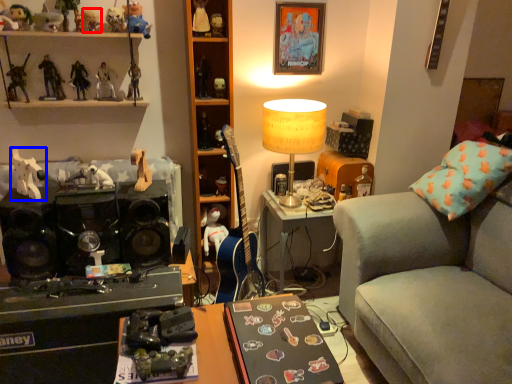
Question: Which object appears closest to the camera in this image, toy (highlighted by a red box) or toy (highlighted by a blue box)?

Choices:
 (A) toy
 (B) toy

Answer: (B)